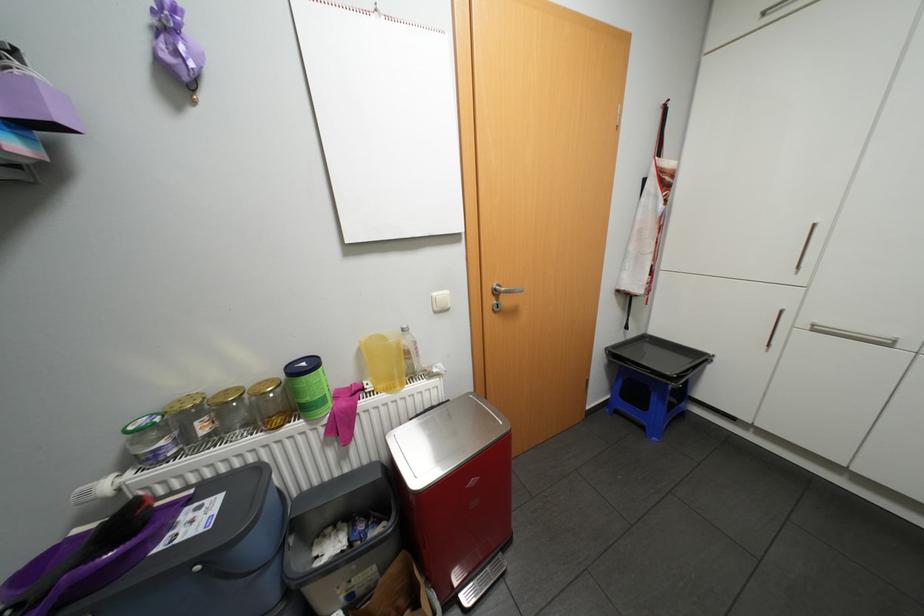
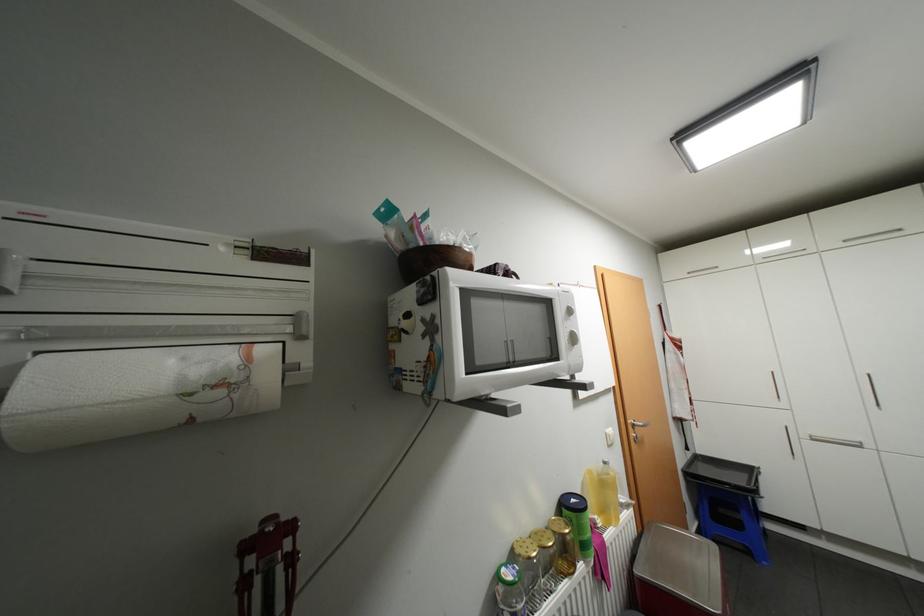
In the second image, find the point that corresponds to (139,427) in the first image.

(518, 576)